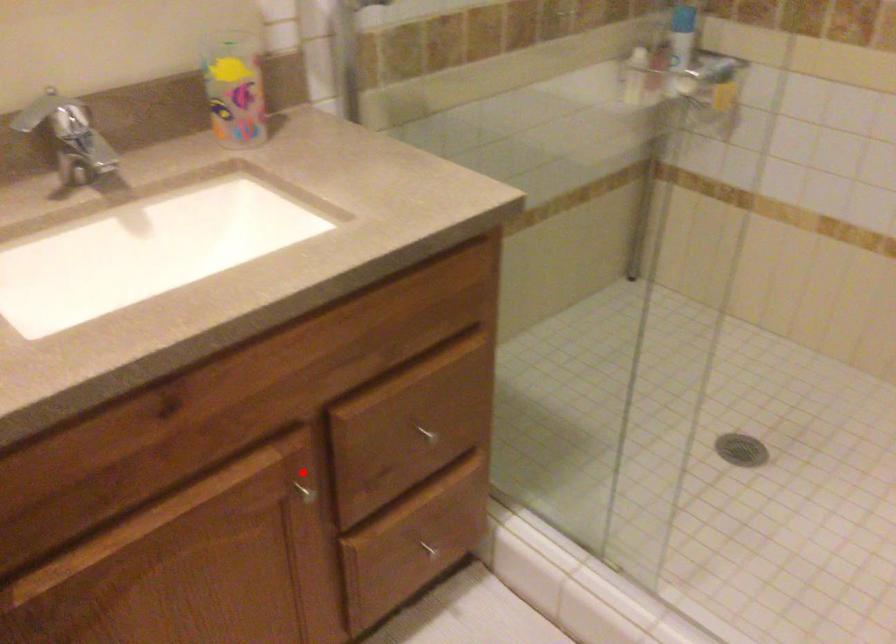
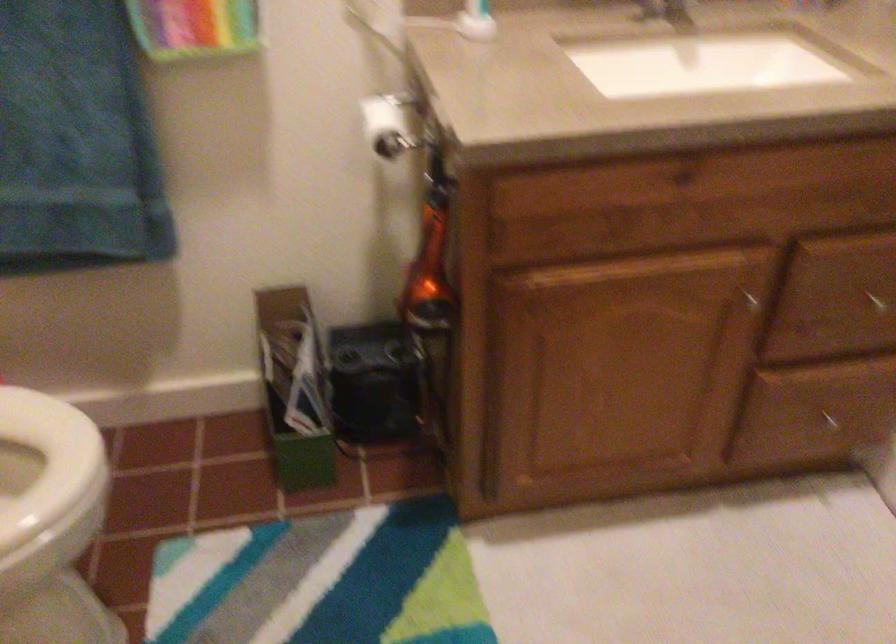
Question: I am providing you with two images of the same scene from different viewpoints. Given a red point in image1, look at the same physical point in image2. Is it:

Choices:
 (A) Closer to the viewpoint
 (B) Farther from the viewpoint

Answer: (B)